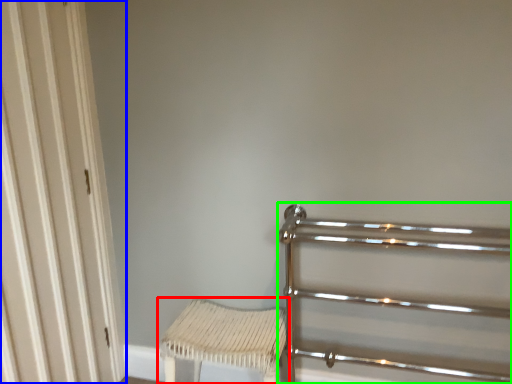
Question: Which object is the farthest from furniture (highlighted by a red box)? Choose among these: door (highlighted by a blue box) or rail (highlighted by a green box).

Choices:
 (A) door
 (B) rail

Answer: (A)